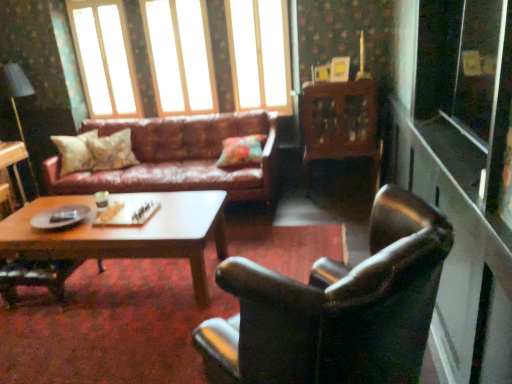
The image size is (512, 384). Describe the element at coordinates (102, 199) in the screenshot. I see `white glossy coffee cup at center` at that location.

How much space does translucent glass window at upper center, acting as the first window starting from the right, occupy horizontally?

4.02 inches.

The height and width of the screenshot is (384, 512). What are the coordinates of `fluffy beige pillow at center, the first pillow positioned from the left` in the screenshot? It's located at (75, 152).

You are a GUI agent. You are given a task and a screenshot of the screen. Output one action in this format:
    pyautogui.click(x=<x>, y=<y>)
    Task: Click on the clear glass window at upper center, which appears as the 3th window when viewed from the right
    
    Given the screenshot: What is the action you would take?
    (105, 58)

Describe the element at coordinates (240, 151) in the screenshot. I see `floral fabric cushion at center, the third pillow when ordered from left to right` at that location.

Find the location of a particular element. The image size is (512, 384). floral fabric cushion at center, which appears as the 1th pillow when viewed from the right is located at coordinates (240, 151).

Identify the location of white glossy coffee cup at center. (102, 199).

Considering the sizes of objects transparent glass screen door at right and wooden cabinet at center in the image provided, who is bigger, transparent glass screen door at right or wooden cabinet at center?

wooden cabinet at center is bigger.

Is the depth of transparent glass screen door at right greater than that of wooden cabinet at center?

No, the depth of transparent glass screen door at right is less than that of wooden cabinet at center.

From the image's perspective, which is below, transparent glass screen door at right or wooden cabinet at center?

wooden cabinet at center is shown below in the image.

You are a GUI agent. You are given a task and a screenshot of the screen. Output one action in this format:
    pyautogui.click(x=<x>, y=<y>)
    Task: Click on the screen door that is above the wooden cabinet at center (from a real-world perspective)
    
    Given the screenshot: What is the action you would take?
    pyautogui.click(x=466, y=89)

From a real-world perspective, who is located lower, wooden cabinet at center or wooden glossy coffee table at center?

wooden glossy coffee table at center, from a real-world perspective.

Would you say wooden cabinet at center is outside wooden glossy coffee table at center?

wooden cabinet at center lies outside wooden glossy coffee table at center's area.

Relative to wooden glossy coffee table at center, is wooden cabinet at center in front or behind?

Clearly, wooden cabinet at center is behind wooden glossy coffee table at center.

From the image's perspective, between wooden cabinet at center and wooden glossy coffee table at center, who is located below?

wooden glossy coffee table at center, from the image's perspective.

Measure the distance from clear glass window at upper center, which appears as the 3th window when viewed from the right, to wooden glossy coffee table at center.

clear glass window at upper center, which appears as the 3th window when viewed from the right, is 8.20 feet away from wooden glossy coffee table at center.

Considering the sizes of objects clear glass window at upper center, the first window positioned from the left, and wooden glossy coffee table at center in the image provided, who is wider, clear glass window at upper center, the first window positioned from the left, or wooden glossy coffee table at center?

wooden glossy coffee table at center is wider.

From the image's perspective, is clear glass window at upper center, which appears as the 3th window when viewed from the right, located above wooden glossy coffee table at center?

Correct, clear glass window at upper center, which appears as the 3th window when viewed from the right, appears higher than wooden glossy coffee table at center in the image.

Does point (156, 18) appear closer or farther from the camera than point (351, 305)?

Clearly, point (156, 18) is more distant from the camera than point (351, 305).

From the picture: From a real-world perspective, is transparent glass window at upper center, which is the second window in left-to-right order, physically below leather armchair at right?

No, from a real-world perspective, transparent glass window at upper center, which is the second window in left-to-right order, is not beneath leather armchair at right.

Looking at the image, does transparent glass window at upper center, which appears as the second window when viewed from the right, seem bigger or smaller compared to leather armchair at right?

transparent glass window at upper center, which appears as the second window when viewed from the right, is smaller than leather armchair at right.

This screenshot has height=384, width=512. I want to click on chair below the transparent glass window at upper center, which is the second window in left-to-right order (from the image's perspective), so click(336, 308).

Would you say transparent glass window at upper center, which is the second window in left-to-right order, contains white glossy coffee cup at center?

No, white glossy coffee cup at center is not a part of transparent glass window at upper center, which is the second window in left-to-right order.

Which is less distant, [191,104] or [99,205]?

The point [99,205] is closer to the camera.

Is transparent glass window at upper center, which appears as the second window when viewed from the right, wider than white glossy coffee cup at center?

Correct, the width of transparent glass window at upper center, which appears as the second window when viewed from the right, exceeds that of white glossy coffee cup at center.

From a real-world perspective, is transparent glass window at upper center, which appears as the second window when viewed from the right, positioned above or below white glossy coffee cup at center?

transparent glass window at upper center, which appears as the second window when viewed from the right, is situated higher than white glossy coffee cup at center in the real world.

Considering the relative positions of matte black lampshade at upper left and fluffy beige pillow at center, positioned as the 3th pillow in right-to-left order, in the image provided, is matte black lampshade at upper left to the right of fluffy beige pillow at center, positioned as the 3th pillow in right-to-left order, from the viewer's perspective?

In fact, matte black lampshade at upper left is to the left of fluffy beige pillow at center, positioned as the 3th pillow in right-to-left order.

Which object is wider, matte black lampshade at upper left or fluffy beige pillow at center, the first pillow positioned from the left?

matte black lampshade at upper left is wider.

What's the angular difference between matte black lampshade at upper left and fluffy beige pillow at center, positioned as the 3th pillow in right-to-left order,'s facing directions?

There is a 43.9-degree angle between the facing directions of matte black lampshade at upper left and fluffy beige pillow at center, positioned as the 3th pillow in right-to-left order.

From a real-world perspective, is matte black lampshade at upper left below fluffy beige pillow at center, the first pillow positioned from the left?

Actually, matte black lampshade at upper left is physically above fluffy beige pillow at center, the first pillow positioned from the left, in the real world.

How many degrees apart are the facing directions of translucent glass window at upper center, acting as the first window starting from the right, and wooden cabinet at center?

The angle between the facing direction of translucent glass window at upper center, acting as the first window starting from the right, and the facing direction of wooden cabinet at center is 0.767 degrees.

Does point (247, 84) appear closer or farther from the camera than point (364, 146)?

Point (247, 84).

Considering the relative sizes of translucent glass window at upper center, acting as the first window starting from the right, and wooden cabinet at center in the image provided, is translucent glass window at upper center, acting as the first window starting from the right, smaller than wooden cabinet at center?

Correct, translucent glass window at upper center, acting as the first window starting from the right, occupies less space than wooden cabinet at center.

Is translucent glass window at upper center, acting as the first window starting from the right, facing towards wooden cabinet at center?

No, translucent glass window at upper center, acting as the first window starting from the right, does not turn towards wooden cabinet at center.

You are a GUI agent. You are given a task and a screenshot of the screen. Output one action in this format:
    pyautogui.click(x=<x>, y=<y>)
    Task: Click on the screen door that is above the wooden cabinet at center (from a real-world perspective)
    
    Given the screenshot: What is the action you would take?
    pyautogui.click(x=466, y=89)

Where is `bookshelf on the right of wooden glossy coffee table at center`? The image size is (512, 384). bookshelf on the right of wooden glossy coffee table at center is located at coordinates (340, 124).

From the image, which object appears to be nearer to clear glass window at upper center, which appears as the 3th window when viewed from the right, floral fabric cushion at center, the third pillow when ordered from left to right, or leather armchair at right?

floral fabric cushion at center, the third pillow when ordered from left to right, is closer to clear glass window at upper center, which appears as the 3th window when viewed from the right.

Based on their spatial positions, is floral fabric pillow at center, the second pillow viewed from the right, or wooden glossy coffee table at center closer to transparent glass screen door at right?

wooden glossy coffee table at center is closer to transparent glass screen door at right.

From the picture: When comparing their distances from leather armchair at right, does wooden glossy coffee table at center or transparent glass window at upper center, which appears as the second window when viewed from the right, seem closer?

Among the two, wooden glossy coffee table at center is located nearer to leather armchair at right.

Estimate the real-world distances between objects in this image. Which object is closer to floral fabric cushion at center, the third pillow when ordered from left to right, wooden cabinet at center or translucent glass window at upper center, which ranks as the third window in left-to-right order?

wooden cabinet at center is closer to floral fabric cushion at center, the third pillow when ordered from left to right.

Based on their spatial positions, is transparent glass screen door at right or wooden cabinet at center closer to floral fabric pillow at center, the second pillow viewed from the right?

wooden cabinet at center.

Which object lies nearer to the anchor point leather armchair at right, transparent glass window at upper center, which appears as the second window when viewed from the right, or leather couch at center?

leather couch at center.

When comparing their distances from white glossy coffee cup at center, does floral fabric pillow at center, the second pillow viewed from the right, or leather couch at center seem further?

leather couch at center is further to white glossy coffee cup at center.

Based on their spatial positions, is matte black lampshade at upper left or transparent glass window at upper center, which is the second window in left-to-right order, further from wooden cabinet at center?

Among the two, matte black lampshade at upper left is located further to wooden cabinet at center.

Locate an element on the screen. The image size is (512, 384). pillow between floral fabric pillow at center, the second pillow viewed from the right, and translucent glass window at upper center, which ranks as the third window in left-to-right order, from left to right is located at coordinates click(x=240, y=151).

The height and width of the screenshot is (384, 512). In order to click on pillow between fluffy beige pillow at center, the first pillow positioned from the left, and floral fabric cushion at center, the third pillow when ordered from left to right, from left to right in this screenshot , I will do `click(112, 151)`.

Identify the location of window between floral fabric pillow at center, which is counted as the 2th pillow, starting from the left, and floral fabric cushion at center, which appears as the 1th pillow when viewed from the right, in the horizontal direction. This screenshot has height=384, width=512. (180, 56).

Locate an element on the screen. studio couch located between wooden glossy coffee table at center and fluffy beige pillow at center, positioned as the 3th pillow in right-to-left order, in the depth direction is located at coordinates (179, 157).